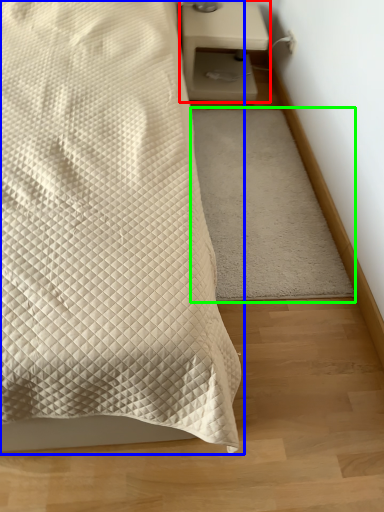
Question: Estimate the real-world distances between objects in this image. Which object is farther from nightstand (highlighted by a red box), bed (highlighted by a blue box) or mat (highlighted by a green box)?

Choices:
 (A) bed
 (B) mat

Answer: (A)